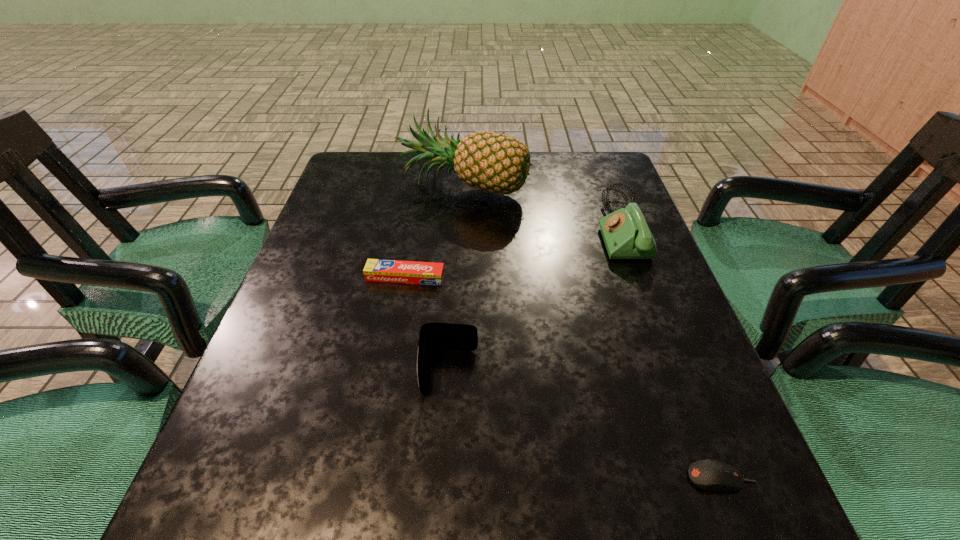
Find the location of `vacant region located 0.060m on the back of the third nearest object`. vacant region located 0.060m on the back of the third nearest object is located at coordinates (410, 251).

You are a GUI agent. You are given a task and a screenshot of the screen. Output one action in this format:
    pyautogui.click(x=<x>, y=<y>)
    Task: Click on the vacant area situated on the back of the computer mouse
    Image resolution: width=960 pixels, height=540 pixels.
    Given the screenshot: What is the action you would take?
    tap(659, 316)

This screenshot has width=960, height=540. I want to click on pineapple at the far edge, so click(492, 162).

I want to click on telephone at the far edge, so click(x=626, y=235).

Locate an element on the screen. The width and height of the screenshot is (960, 540). object at the near edge is located at coordinates pyautogui.click(x=709, y=475).

This screenshot has height=540, width=960. Find the location of `object that is at the left edge`. object that is at the left edge is located at coordinates (395, 271).

This screenshot has height=540, width=960. I want to click on telephone situated at the right edge, so click(626, 235).

Where is `computer mouse that is at the right edge`? This screenshot has height=540, width=960. computer mouse that is at the right edge is located at coordinates coord(709,475).

This screenshot has width=960, height=540. I want to click on object at the far right corner, so click(x=626, y=235).

Where is `object that is at the near right corner`? object that is at the near right corner is located at coordinates (709, 475).